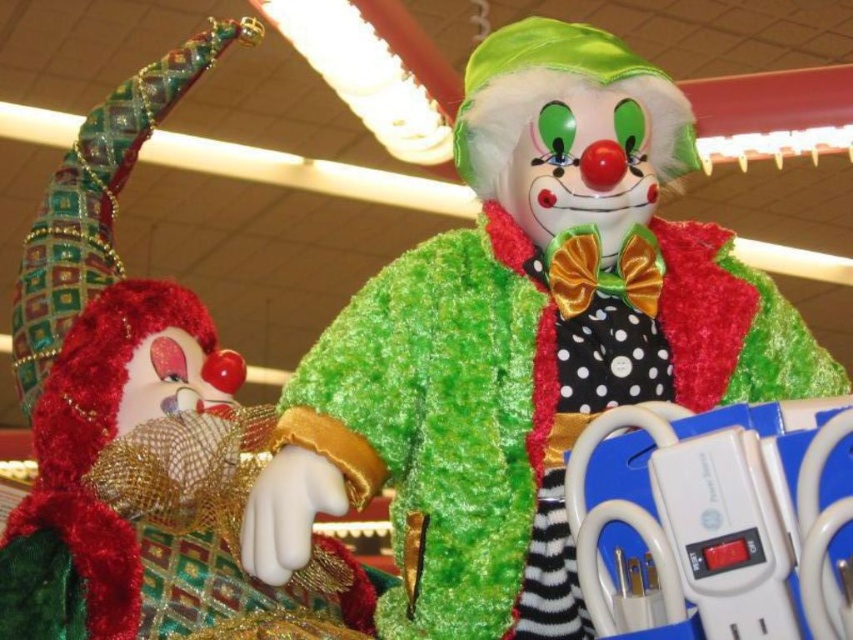
You are standing in front of a festive display and see the fuzzy green clown at center and the velvet red clown at left. Which one is positioned to the right of the other?

The fuzzy green clown at center is positioned to the right of the velvet red clown at left.

Consider the image. You are standing in front of a festive display with two clowns. You see a fuzzy green clown at center and another clown. Which clown is closer to you?

The fuzzy green clown at center is closer to you as it is only 28.44 inches away from the viewer.

You are a visitor at a holiday market and see the fuzzy green clown at center and the velvet red clown at left. Which clown is closer to you?

The fuzzy green clown at center is closer to you because it is positioned in front of the velvet red clown at left.